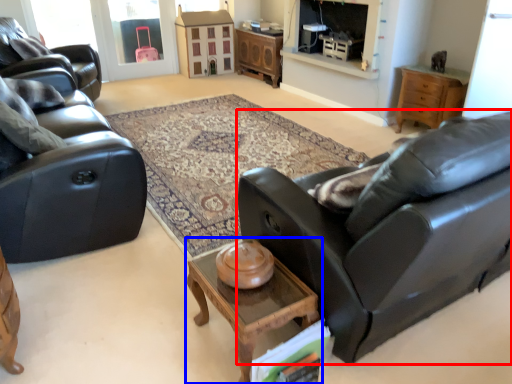
Question: Among these objects, which one is nearest to the camera, studio couch (highlighted by a red box) or coffee table (highlighted by a blue box)?

Choices:
 (A) studio couch
 (B) coffee table

Answer: (A)